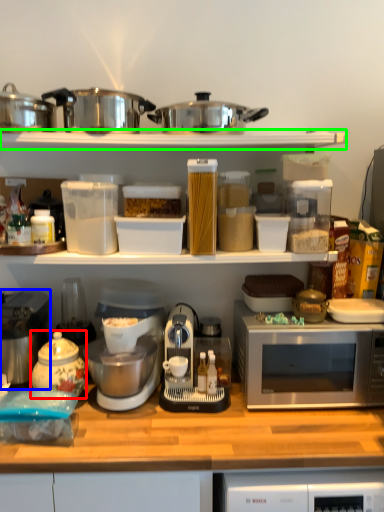
Question: Which object is positioned farthest from tea pot (highlighted by a red box)? Select from home appliance (highlighted by a blue box) and shelf (highlighted by a green box).

Choices:
 (A) home appliance
 (B) shelf

Answer: (B)